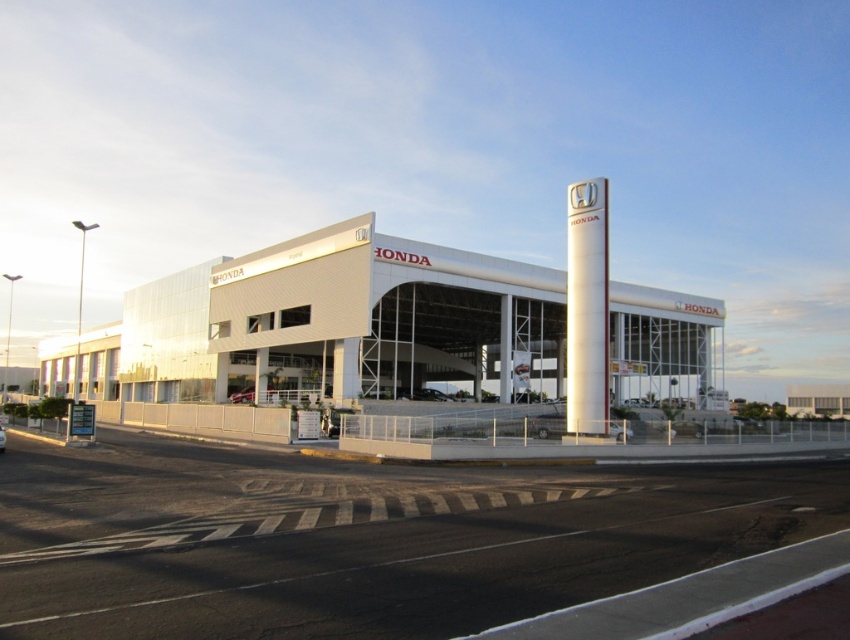
You are a delivery person trying to determine the best spot to park your truck near the dealership. The truck requires a parking space that is taller than the white glossy pillar at center. Can you park your truck near the white matte building at center?

The white matte building at center is taller than the white glossy pillar at center, so yes, you can park your truck near the white matte building at center as it meets the height requirement.

You are standing at the entrance of the Honda dealership and see two points marked on the ground. The first point is at position point (x=261, y=250) and the second is at point (x=511, y=333). Which point is closer to you?

Point (x=261, y=250) is further to the camera than point (x=511, y=333), so the point closer to you is point (x=511, y=333).

Consider the image. You are a delivery driver who needs to park your truck, which is 10 meters long, between the white smooth pillar at center and the metallic silver sedan at center. Can you fit your truck there without touching either object?

The distance between the white smooth pillar at center and the metallic silver sedan at center is 37.17 meters. Since your truck is only 10 meters long, there is ample space to park it between them without touching either object.